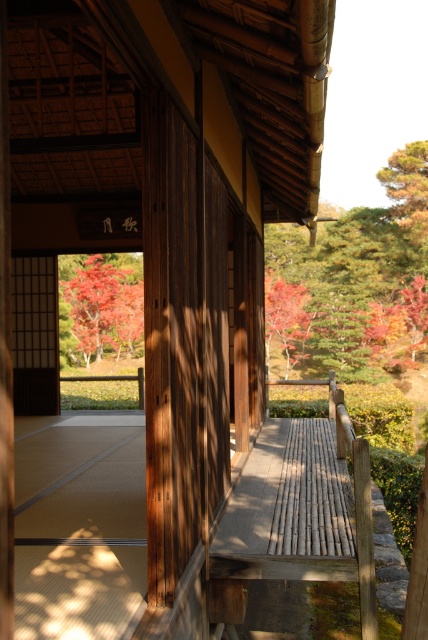
You are an artist sketching the scene and want to capture the autumn leaves at upper right and the vivid red leaves at center. Which of these two leaf clusters is located to the right of the other?

The autumn leaves at upper right is positioned on the right side of vivid red leaves at center.

You are standing on the wooden veranda of a traditional Japanese temple and notice two points marked on the floor. One is at coordinate point (x=395, y=278) and the other at point (x=76, y=285). Which point is closer to you as you face the veranda?

Point (x=76, y=285) is closer to you because it is positioned further away from the camera compared to point (x=395, y=278), which is closer to the camera.